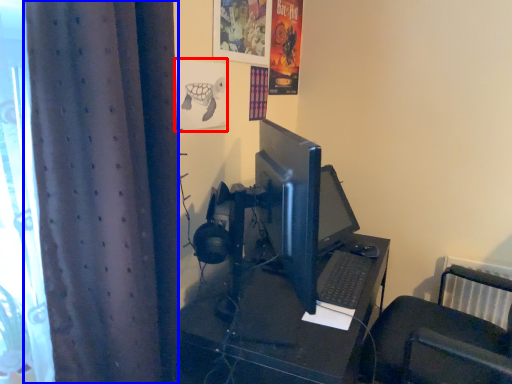
Question: Among these objects, which one is farthest to the camera, poster page (highlighted by a red box) or curtain (highlighted by a blue box)?

Choices:
 (A) poster page
 (B) curtain

Answer: (A)